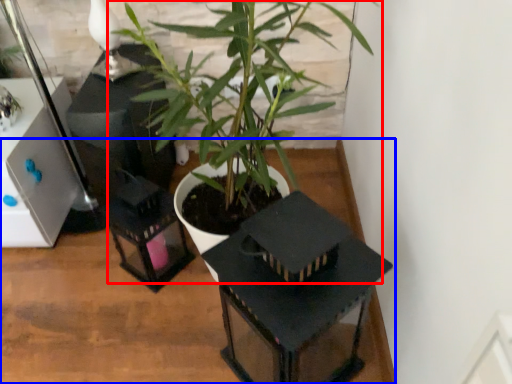
Question: Which object is further to the camera taking this photo, houseplant (highlighted by a red box) or table (highlighted by a blue box)?

Choices:
 (A) houseplant
 (B) table

Answer: (B)